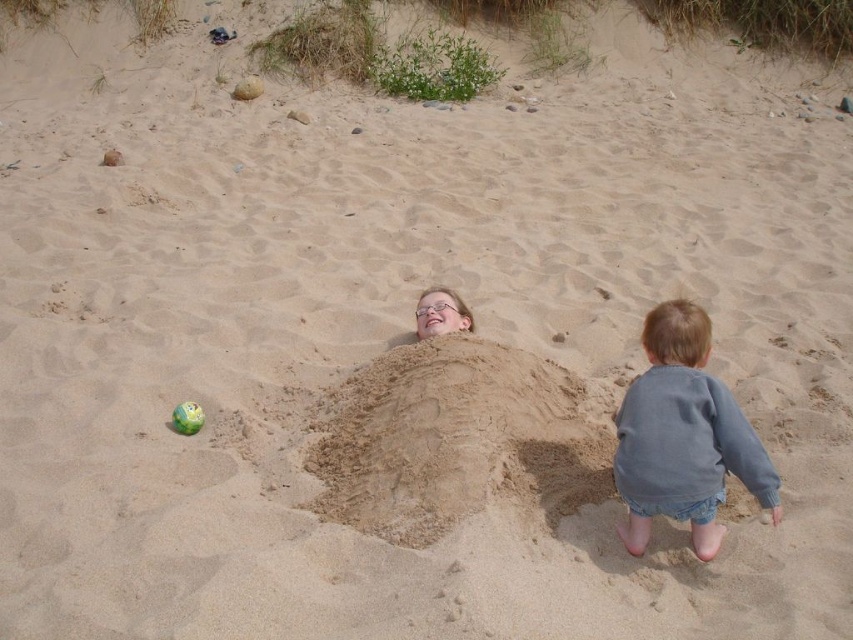
In the scene shown: You are a parent watching your children at the beach. You see the beige sand mound at center and the green rubber ball at center. Which object takes up more space in the scene?

The beige sand mound at center has a larger size compared to the green rubber ball at center, so it takes up more space in the scene.

You are a photographer trying to capture a photo of both the beige sand mound at center and the denim shorts at lower right. Which object should you adjust your camera focus on first to ensure both are in the frame?

The beige sand mound at center is closer to the camera than the denim shorts at lower right. To ensure both are in focus, adjust the camera focus on the beige sand mound at center first, then the denim shorts at lower right.

You are a photographer taking a picture of the beach scene. You notice the denim shorts at lower right and the green rubber ball at center. Which object is positioned higher in the image?

The denim shorts at lower right is above the green rubber ball at center in the image.